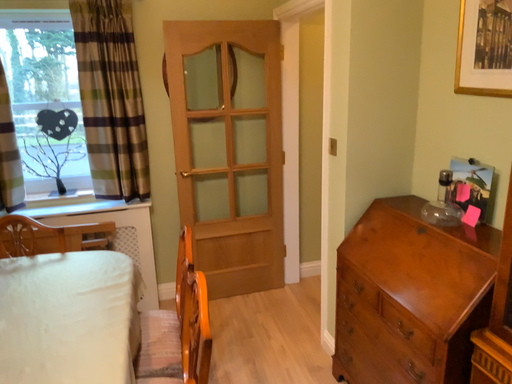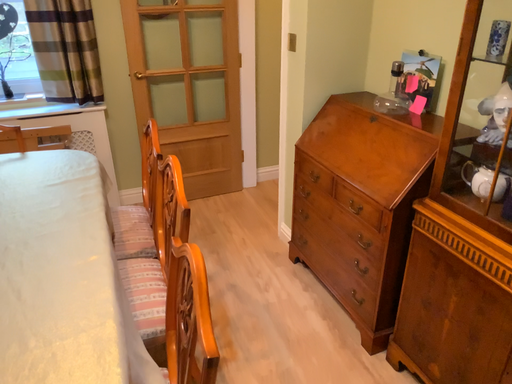
Question: Which way did the camera rotate in the video?

Choices:
 (A) rotated left
 (B) rotated right

Answer: (B)